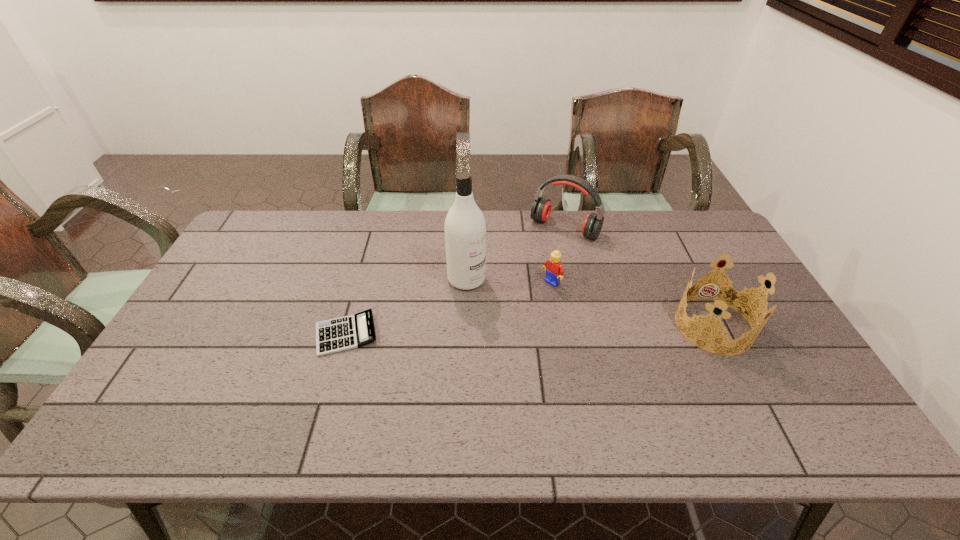
The width and height of the screenshot is (960, 540). What are the coordinates of `unoccupied position between the earphone and the rightmost object` in the screenshot? It's located at (639, 276).

At what (x,y) coordinates should I click in order to perform the action: click on free space between the crown and the earphone. Please return your answer as a coordinate pair (x, y). The width and height of the screenshot is (960, 540). Looking at the image, I should click on (639, 276).

Locate an element on the screen. This screenshot has width=960, height=540. empty space that is in between the shampoo and the farthest object is located at coordinates (516, 253).

At what (x,y) coordinates should I click in order to perform the action: click on object that ranks as the fourth closest to the shortest object. Please return your answer as a coordinate pair (x, y). The width and height of the screenshot is (960, 540). Looking at the image, I should click on (729, 298).

Locate which object ranks in proximity to the fourth tallest object. Please provide its 2D coordinates. Your answer should be formatted as a tuple, i.e. [(x, y)], where the tuple contains the x and y coordinates of a point satisfying the conditions above.

[(541, 208)]

The image size is (960, 540). Find the location of `vacant area in the image that satisfies the following two spatial constraints: 1. on the back side of the calculator; 2. on the left side of the Lego`. vacant area in the image that satisfies the following two spatial constraints: 1. on the back side of the calculator; 2. on the left side of the Lego is located at coordinates (361, 283).